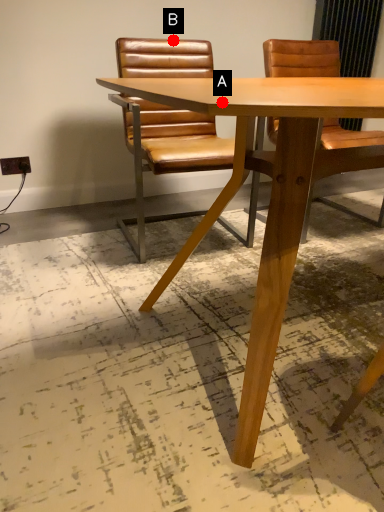
Question: Two points are circled on the image, labeled by A and B beside each circle. Which point is closer to the camera?

Choices:
 (A) A is closer
 (B) B is closer

Answer: (A)